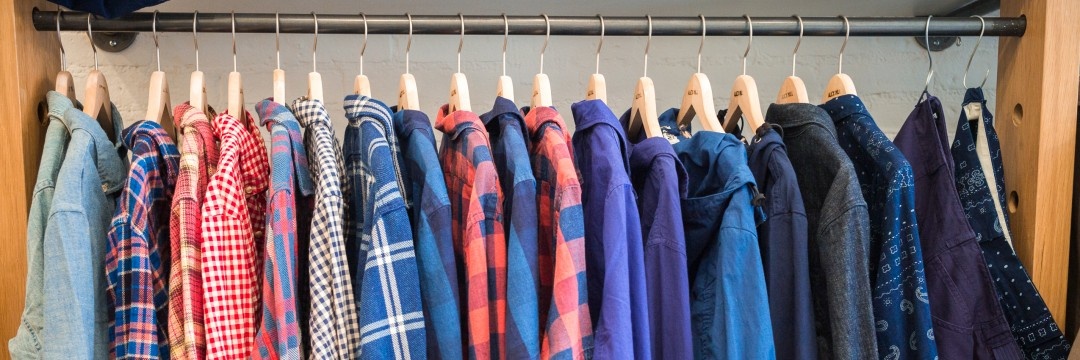
This screenshot has height=360, width=1080. I want to click on bottom part of hanger, so click(x=843, y=85).